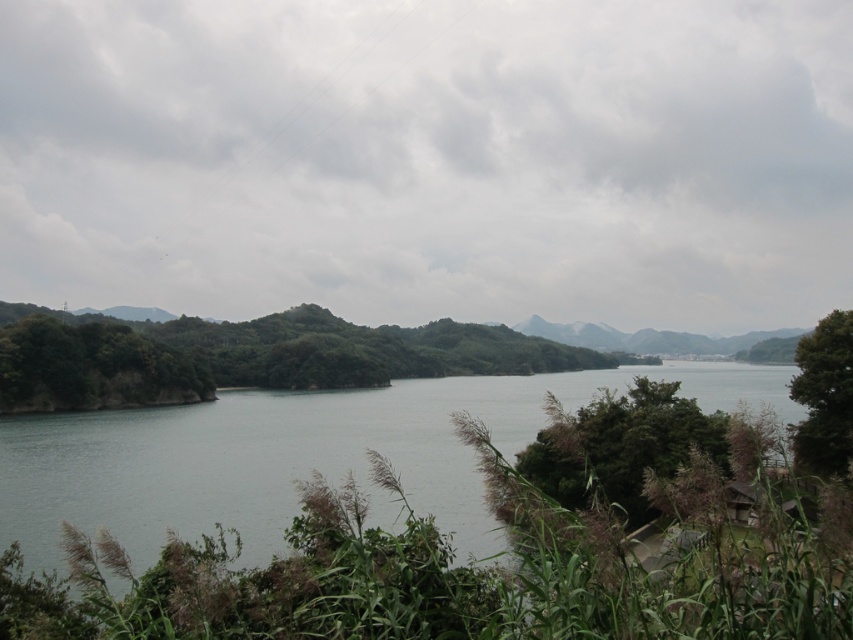
Can you confirm if gray water at center is positioned to the left of green leafy shrubs at left?

No, gray water at center is not to the left of green leafy shrubs at left.

Who is higher up, gray water at center or green leafy shrubs at left?

Positioned higher is green leafy shrubs at left.

What do you see at coordinates (302, 456) in the screenshot? The height and width of the screenshot is (640, 853). I see `gray water at center` at bounding box center [302, 456].

What are the coordinates of `gray water at center` in the screenshot? It's located at [x=302, y=456].

The width and height of the screenshot is (853, 640). What do you see at coordinates (244, 355) in the screenshot?
I see `green leafy shrubs at left` at bounding box center [244, 355].

Is point (41, 346) closer to camera compared to point (846, 314)?

That is False.

Is point (178, 342) behind point (839, 442)?

Yes, point (178, 342) is farther from viewer.

Locate an element on the screen. This screenshot has width=853, height=640. green leafy shrubs at left is located at coordinates (244, 355).

The width and height of the screenshot is (853, 640). I want to click on gray water at center, so click(302, 456).

Identify the location of gray water at center. This screenshot has height=640, width=853. (302, 456).